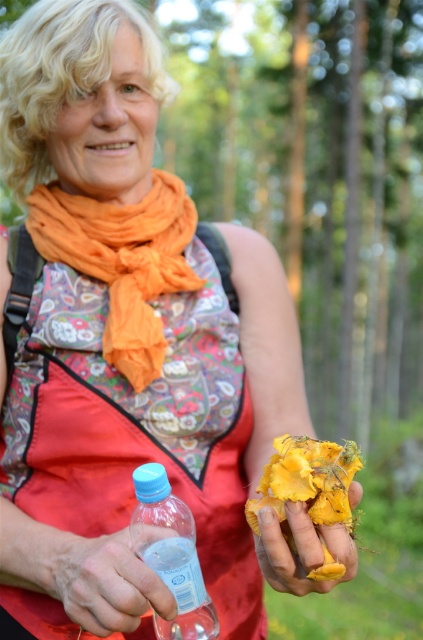
Is point (302, 436) farther from viewer compared to point (271, 522)?

Yes, point (302, 436) is behind point (271, 522).

Does point (362, 465) lie in front of point (297, 525)?

No.

What do you see at coordinates (307, 480) in the screenshot?
I see `yellow matte flower at center` at bounding box center [307, 480].

Where is `yellow matte flower at center`? yellow matte flower at center is located at coordinates (307, 480).

Is transparent plastic bottle at lower left shorter than yellow matte flower at center?

No, transparent plastic bottle at lower left is not shorter than yellow matte flower at center.

Is point (208, 628) positioned in front of point (277, 436)?

Yes, it is.

Is point (186, 566) behind point (343, 500)?

Yes.

Identify the location of transparent plastic bottle at lower left. The image size is (423, 640). point(170,554).

Does orange silk scarf at upper center have a larger size compared to yellow matte flower at center?

Yes, orange silk scarf at upper center is bigger than yellow matte flower at center.

What do you see at coordinates (123, 260) in the screenshot? I see `orange silk scarf at upper center` at bounding box center [123, 260].

Image resolution: width=423 pixels, height=640 pixels. In order to click on orange silk scarf at upper center in this screenshot , I will do `click(123, 260)`.